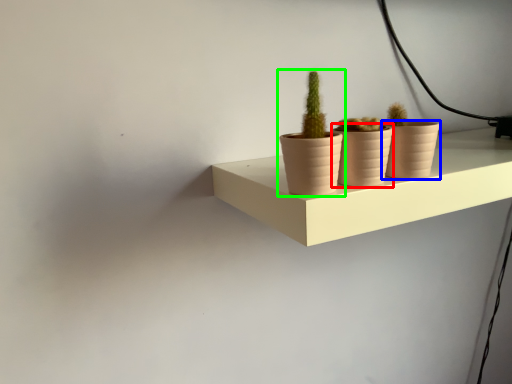
Question: Based on their relative distances, which object is farther from flowerpot (highlighted by a red box)? Choose from flowerpot (highlighted by a blue box) and houseplant (highlighted by a green box).

Choices:
 (A) flowerpot
 (B) houseplant

Answer: (A)